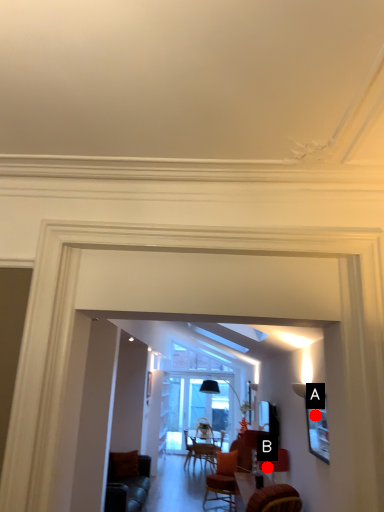
Question: Two points are circled on the image, labeled by A and B beside each circle. Which point is farther from the camera taking this photo?

Choices:
 (A) A is further
 (B) B is further

Answer: (B)